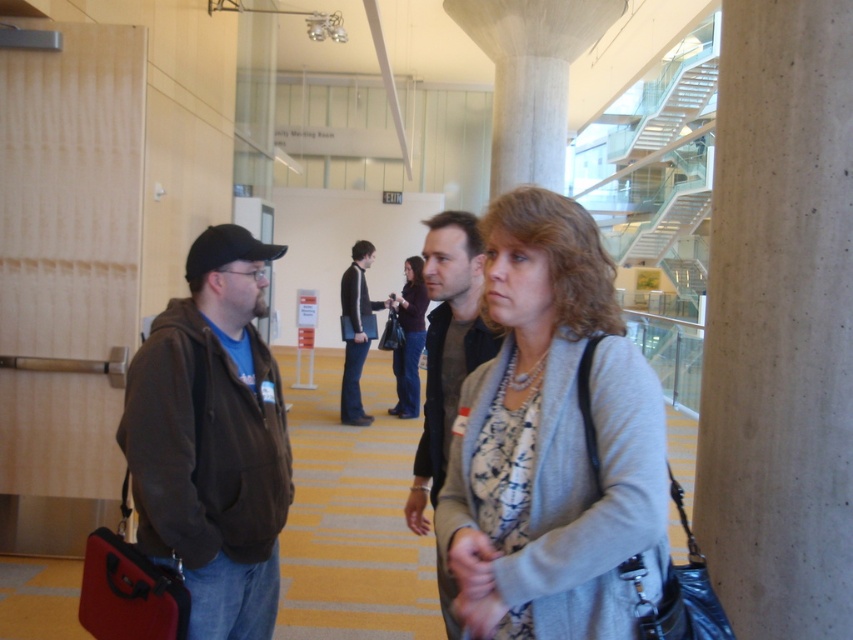
Question: Among these points, which one is nearest to the camera?

Choices:
 (A) (851, 108)
 (B) (349, 358)
 (C) (254, 467)
 (D) (392, 353)

Answer: (C)

Question: Which point appears closest to the camera in this image?

Choices:
 (A) (343, 275)
 (B) (506, 355)

Answer: (B)

Question: Among these points, which one is nearest to the camera?

Choices:
 (A) (752, 458)
 (B) (535, 317)

Answer: (B)

Question: Can you confirm if gray knit sweater at center is positioned to the left of matte gray sweater at center?

Choices:
 (A) no
 (B) yes

Answer: (A)

Question: Does gray knit sweater at center have a larger size compared to dark gray jacket at center?

Choices:
 (A) no
 (B) yes

Answer: (A)

Question: Does gray knit sweater at center have a larger size compared to black leather jacket at center?

Choices:
 (A) yes
 (B) no

Answer: (B)